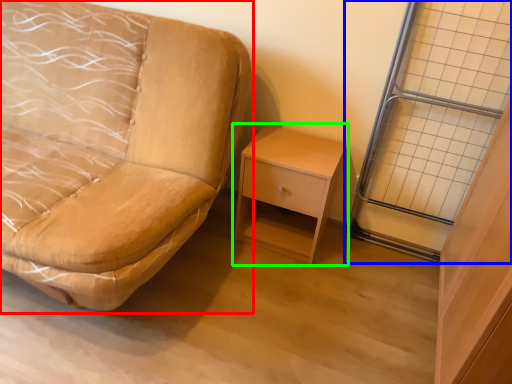
Question: Based on their relative distances, which object is nearer to studio couch (highlighted by a red box)? Choose from glass door (highlighted by a blue box) and nightstand (highlighted by a green box).

Choices:
 (A) glass door
 (B) nightstand

Answer: (B)